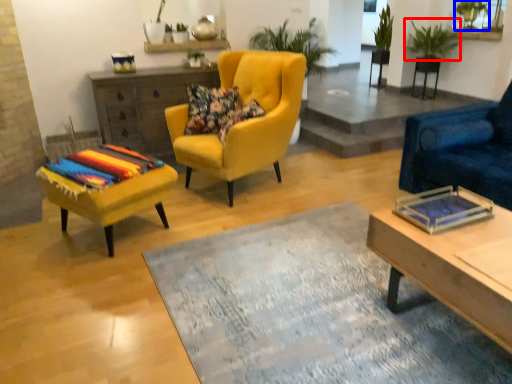
Question: Among these objects, which one is nearest to the camera, plant (highlighted by a red box) or plant (highlighted by a blue box)?

Choices:
 (A) plant
 (B) plant

Answer: (A)